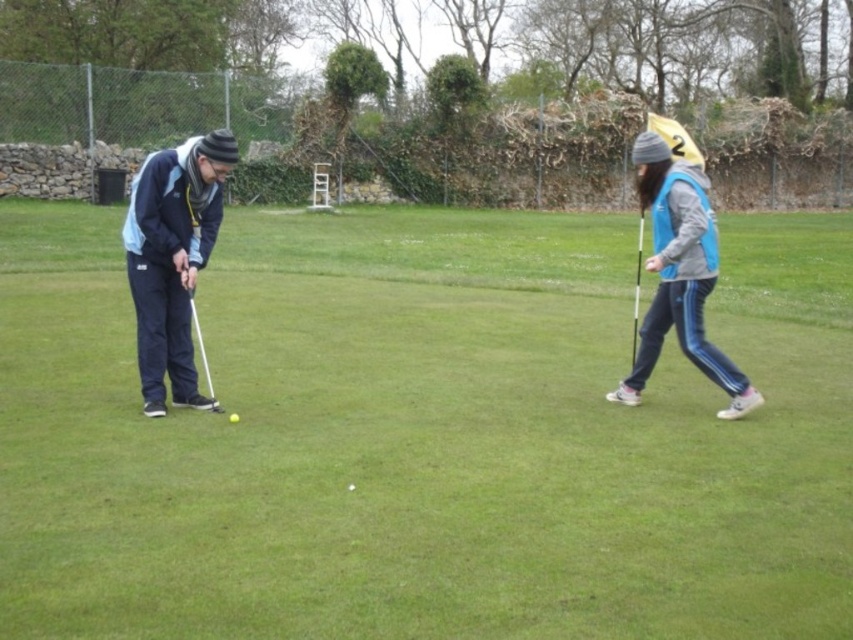
Question: Can you confirm if metallic silver golf club at left is positioned to the right of white matte golf ball at center?

Choices:
 (A) no
 (B) yes

Answer: (A)

Question: Can you confirm if metallic silver golf club at left is positioned above white matte golf ball at center?

Choices:
 (A) no
 (B) yes

Answer: (B)

Question: Is green grass at center above white matte golf ball at center?

Choices:
 (A) yes
 (B) no

Answer: (A)

Question: Which of the following is the farthest from the observer?

Choices:
 (A) matte blue tracksuit at left
 (B) yellow matte golf ball at center

Answer: (A)

Question: Which object is closer to the camera taking this photo?

Choices:
 (A) yellow matte golf ball at center
 (B) green grass at center
 (C) blue fabric vest at right
 (D) white matte golf ball at center

Answer: (B)

Question: Which point is farther to the camera?

Choices:
 (A) (642, 214)
 (B) (155, 243)
 (C) (183, 273)
 (D) (352, 484)

Answer: (A)